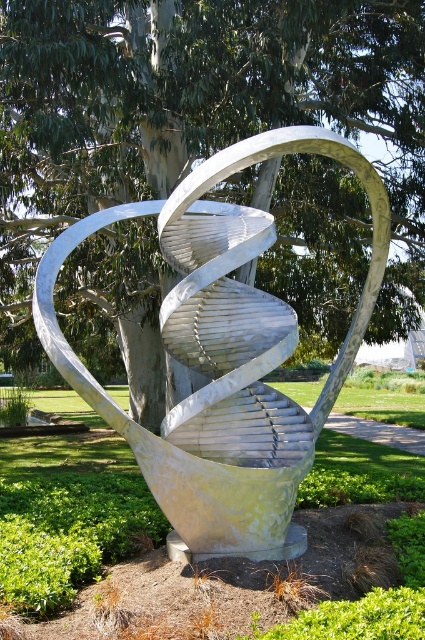
Question: Which object is closer to the camera taking this photo?

Choices:
 (A) green leafy tree at center
 (B) silver metallic spiral at center

Answer: (B)

Question: Which point is farther to the camera?

Choices:
 (A) green leafy tree at center
 (B) silver metallic spiral at center
 (C) metallic silver sculpture at center

Answer: (A)

Question: Does green leafy tree at center have a larger size compared to metallic silver sculpture at center?

Choices:
 (A) no
 (B) yes

Answer: (B)

Question: Is green leafy tree at center wider than metallic silver sculpture at center?

Choices:
 (A) no
 (B) yes

Answer: (A)

Question: Is green leafy tree at center wider than silver metallic spiral at center?

Choices:
 (A) no
 (B) yes

Answer: (B)

Question: Which point is farther from the camera taking this photo?

Choices:
 (A) (176, 51)
 (B) (240, 236)
 (C) (365, 468)

Answer: (C)